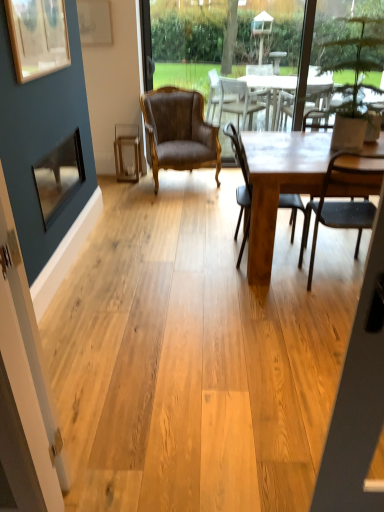
Question: Can you confirm if brown leather armchair at center, acting as the first chair starting from the back, is smaller than wooden table at center?

Choices:
 (A) no
 (B) yes

Answer: (B)

Question: Does brown leather armchair at center, acting as the first chair starting from the back, have a larger size compared to wooden table at center?

Choices:
 (A) yes
 (B) no

Answer: (B)

Question: Is brown leather armchair at center, acting as the first chair starting from the back, placed right next to wooden table at center?

Choices:
 (A) no
 (B) yes

Answer: (A)

Question: Can you confirm if brown leather armchair at center, which is the third chair in front-to-back order, is thinner than wooden table at center?

Choices:
 (A) yes
 (B) no

Answer: (A)

Question: Is brown leather armchair at center, acting as the first chair starting from the back, to the left of wooden table at center from the viewer's perspective?

Choices:
 (A) yes
 (B) no

Answer: (A)

Question: Considering the positions of matte brown chair at center, placed as the 2th chair when sorted from front to back, and wooden table at center in the image, is matte brown chair at center, placed as the 2th chair when sorted from front to back, wider or thinner than wooden table at center?

Choices:
 (A) thin
 (B) wide

Answer: (A)

Question: From a real-world perspective, is matte brown chair at center, the second chair viewed from the left, physically located above or below wooden table at center?

Choices:
 (A) above
 (B) below

Answer: (A)

Question: In terms of size, does matte brown chair at center, which is the 2th chair from right to left, appear bigger or smaller than wooden table at center?

Choices:
 (A) small
 (B) big

Answer: (A)

Question: Considering the positions of matte brown chair at center, the second chair viewed from the left, and wooden table at center in the image, is matte brown chair at center, the second chair viewed from the left, taller or shorter than wooden table at center?

Choices:
 (A) short
 (B) tall

Answer: (B)

Question: Is point (99, 10) closer or farther from the camera than point (145, 94)?

Choices:
 (A) farther
 (B) closer

Answer: (B)

Question: Choose the correct answer: Is matte gold picture frame at upper left, the third picture frame viewed from the front, inside brown leather armchair at center, acting as the 1th chair starting from the left, or outside it?

Choices:
 (A) inside
 (B) outside

Answer: (B)

Question: In the image, is matte gold picture frame at upper left, the first picture frame from the back, positioned in front of or behind brown leather armchair at center, acting as the 1th chair starting from the left?

Choices:
 (A) front
 (B) behind

Answer: (B)

Question: Considering the positions of matte gold picture frame at upper left, the third picture frame viewed from the front, and brown leather armchair at center, acting as the first chair starting from the back, in the image, is matte gold picture frame at upper left, the third picture frame viewed from the front, taller or shorter than brown leather armchair at center, acting as the first chair starting from the back,?

Choices:
 (A) tall
 (B) short

Answer: (B)

Question: Is point (271, 251) closer or farther from the camera than point (281, 5)?

Choices:
 (A) closer
 (B) farther

Answer: (A)

Question: Considering the positions of wooden table at center and brown leather chair at center in the image, is wooden table at center wider or thinner than brown leather chair at center?

Choices:
 (A) thin
 (B) wide

Answer: (B)